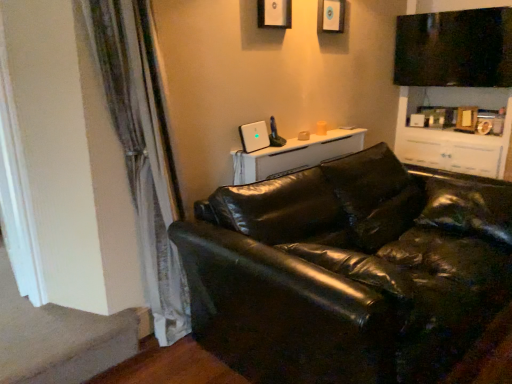
Question: Does carpet at lower left have a lesser width compared to matte white picture frame at upper center, the 1th picture frame positioned from the back?

Choices:
 (A) no
 (B) yes

Answer: (A)

Question: Is carpet at lower left not within matte white picture frame at upper center, arranged as the second picture frame when viewed from the front?

Choices:
 (A) yes
 (B) no

Answer: (A)

Question: Does carpet at lower left touch matte white picture frame at upper center, the 1th picture frame positioned from the back?

Choices:
 (A) no
 (B) yes

Answer: (A)

Question: From the image's perspective, would you say carpet at lower left is shown under matte white picture frame at upper center, arranged as the first picture frame when viewed from the right?

Choices:
 (A) yes
 (B) no

Answer: (A)

Question: From the image's perspective, is carpet at lower left on top of matte white picture frame at upper center, the second picture frame when ordered from left to right?

Choices:
 (A) no
 (B) yes

Answer: (A)

Question: Is carpet at lower left taller or shorter than matte black picture frame at upper center, which is counted as the 1th picture frame, starting from the left?

Choices:
 (A) tall
 (B) short

Answer: (B)

Question: Considering their positions, is carpet at lower left located in front of or behind matte black picture frame at upper center, the 2th picture frame when ordered from back to front?

Choices:
 (A) front
 (B) behind

Answer: (A)

Question: From the image's perspective, is carpet at lower left located above or below matte black picture frame at upper center, which is counted as the 1th picture frame, starting from the left?

Choices:
 (A) below
 (B) above

Answer: (A)

Question: Based on their sizes in the image, would you say carpet at lower left is bigger or smaller than matte black picture frame at upper center, the 2th picture frame when ordered from back to front?

Choices:
 (A) small
 (B) big

Answer: (B)

Question: In the image, is white glossy table at upper center positioned in front of or behind matte black picture frame at upper center, the 2th picture frame when ordered from back to front?

Choices:
 (A) front
 (B) behind

Answer: (A)

Question: Is white glossy table at upper center inside or outside of matte black picture frame at upper center, which is the second picture frame in right-to-left order?

Choices:
 (A) inside
 (B) outside

Answer: (B)

Question: Is point (260, 157) closer or farther from the camera than point (266, 8)?

Choices:
 (A) farther
 (B) closer

Answer: (A)

Question: From a real-world perspective, is white glossy table at upper center positioned above or below matte black picture frame at upper center, the 2th picture frame when ordered from back to front?

Choices:
 (A) below
 (B) above

Answer: (A)

Question: Looking at their shapes, would you say white glossy table at upper center is wider or thinner than carpet at lower left?

Choices:
 (A) thin
 (B) wide

Answer: (A)

Question: Considering the positions of white glossy table at upper center and carpet at lower left in the image, is white glossy table at upper center bigger or smaller than carpet at lower left?

Choices:
 (A) big
 (B) small

Answer: (B)